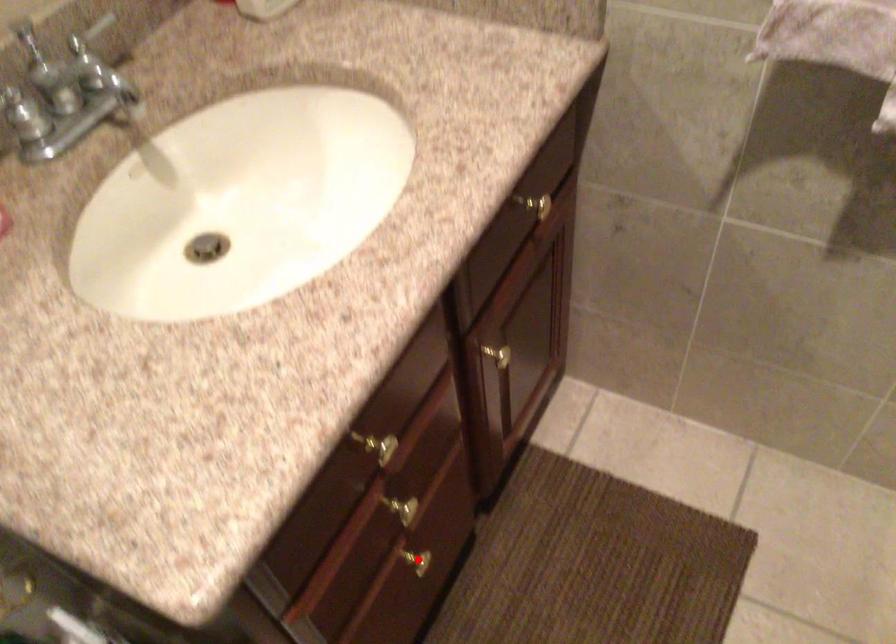
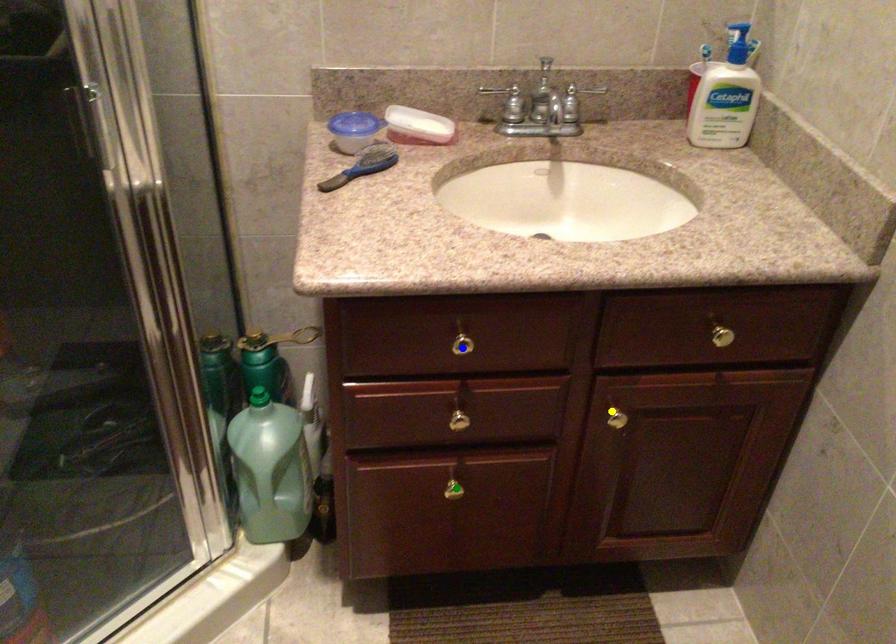
Question: I am providing you with two images of the same scene from different viewpoints. A red point is marked on the first image. You are given multiple points on the second image. Can you choose the point in image 2 that corresponds to the point in image 1?

Choices:
 (A) blue point
 (B) yellow point
 (C) green point

Answer: (C)